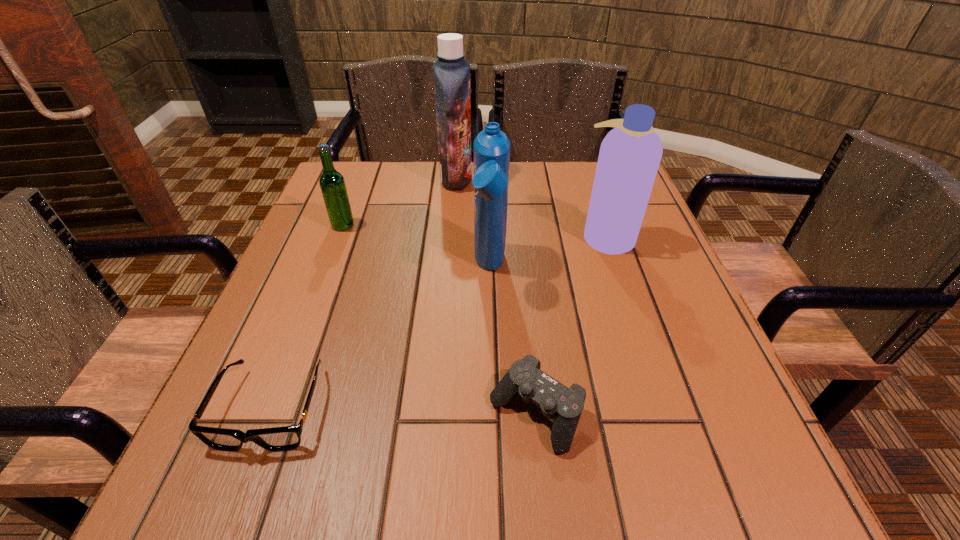
Where is `the farthest shampoo`? The width and height of the screenshot is (960, 540). the farthest shampoo is located at coordinates (451, 72).

The width and height of the screenshot is (960, 540). Find the location of `the fourth object from right to left`. the fourth object from right to left is located at coordinates (451, 72).

Identify the location of the rightmost shampoo. Image resolution: width=960 pixels, height=540 pixels. (630, 154).

Locate an element on the screen. the second shampoo from left to right is located at coordinates (491, 146).

Locate an element on the screen. This screenshot has height=540, width=960. beer bottle is located at coordinates click(x=332, y=184).

This screenshot has width=960, height=540. I want to click on the fifth tallest object, so click(x=556, y=401).

At what (x,y) coordinates should I click in order to perform the action: click on the shortest object. Please return your answer as a coordinate pair (x, y). Looking at the image, I should click on (284, 438).

Image resolution: width=960 pixels, height=540 pixels. Identify the location of vacant space situated on the front label of the farthest object. (516, 178).

I want to click on free spot located 0.200m on the left of the rightmost shampoo, so click(493, 237).

Find the location of a particular element. free space located 0.240m on the left of the second shampoo from right to left is located at coordinates (361, 268).